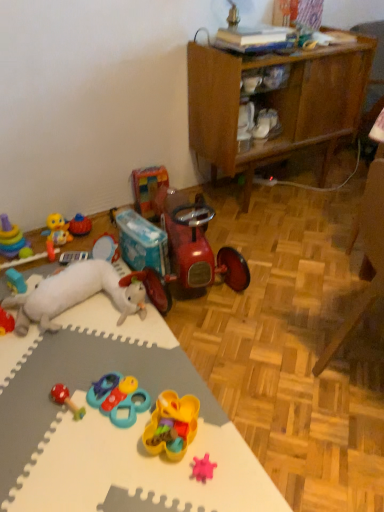
Locate an element on the screen. Image resolution: width=384 pixels, height=512 pixels. free area in between teal plastic toy at center, the 5th toy viewed from the right, and rubberized red and green toy at lower left, the 6th toy positioned from the right is located at coordinates (94, 411).